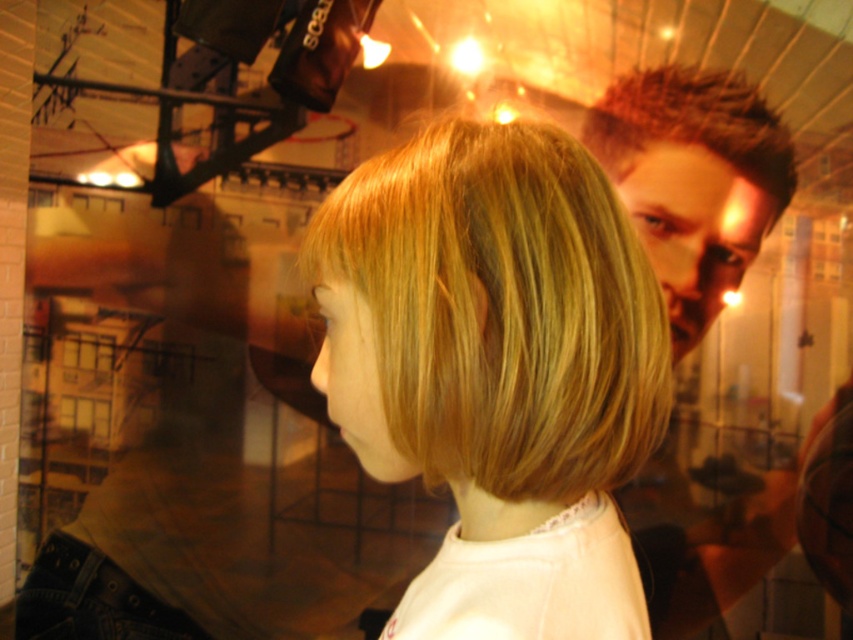
Question: Does blonde hair at center have a lesser width compared to slicked hair at upper right?

Choices:
 (A) no
 (B) yes

Answer: (B)

Question: Among these points, which one is farthest from the camera?

Choices:
 (A) (660, 132)
 (B) (697, 586)
 (C) (659, 412)

Answer: (B)

Question: Can you confirm if slicked hair at upper right is positioned to the right of denim at lower left?

Choices:
 (A) no
 (B) yes

Answer: (B)

Question: Which point appears closest to the camera in this image?

Choices:
 (A) (56, 632)
 (B) (335, 269)
 (C) (630, 157)

Answer: (B)

Question: Which of the following is the farthest from the observer?

Choices:
 (A) blonde hair at center
 (B) slicked hair at upper right

Answer: (B)

Question: Is blonde hair at center to the left of spiky brown hair at upper right from the viewer's perspective?

Choices:
 (A) yes
 (B) no

Answer: (A)